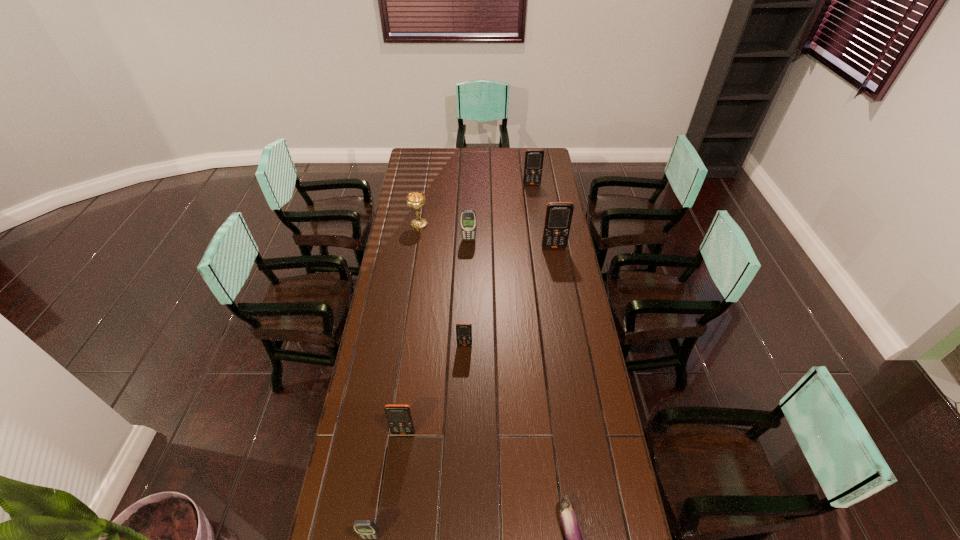
The image size is (960, 540). I want to click on the fourth nearest cellular telephone, so click(558, 217).

Where is `the tallest cellular telephone`? This screenshot has height=540, width=960. the tallest cellular telephone is located at coordinates (558, 217).

Where is `the farthest orange cellular telephone`? The height and width of the screenshot is (540, 960). the farthest orange cellular telephone is located at coordinates (533, 165).

The width and height of the screenshot is (960, 540). What are the coordinates of `the second biggest orange cellular telephone` in the screenshot? It's located at [x=533, y=165].

Image resolution: width=960 pixels, height=540 pixels. Find the location of `the farther gray cellular telephone`. the farther gray cellular telephone is located at coordinates (468, 217).

The height and width of the screenshot is (540, 960). In order to click on the second farthest cellular telephone in this screenshot , I will do pyautogui.click(x=468, y=217).

Find the location of a particular element. the fifth farthest cellular telephone is located at coordinates (399, 416).

At what (x,y) coordinates should I click in order to perform the action: click on the nearest orange cellular telephone. Please return your answer as a coordinate pair (x, y). Looking at the image, I should click on (399, 416).

Find the location of a particular element. the second farthest object is located at coordinates (416, 200).

Locate an element on the screen. the fifth farthest object is located at coordinates (463, 330).